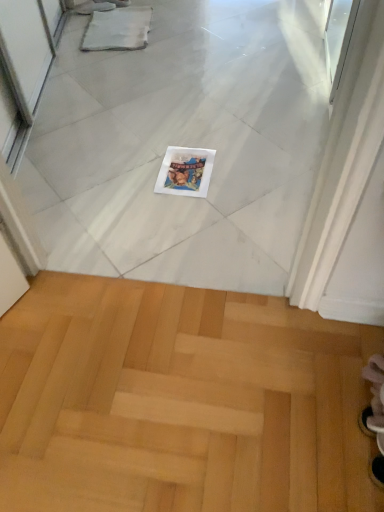
Locate an element on the screen. The width and height of the screenshot is (384, 512). vacant region above white glossy magazine at center (from a real-world perspective) is located at coordinates (188, 165).